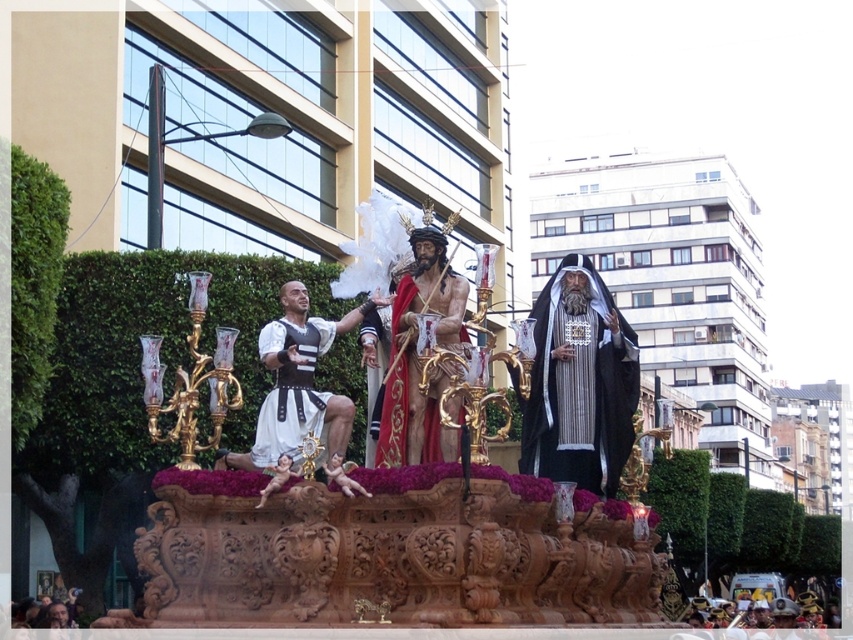
Question: Which object appears farthest from the camera in this image?

Choices:
 (A) white leather tunic at center
 (B) smooth flesh cherub at center
 (C) white matte fabric at center

Answer: (A)

Question: Which is farther from the white matte fabric at center?

Choices:
 (A) smooth flesh cherub at center
 (B) smooth pink cherub at center
 (C) white leather tunic at center

Answer: (A)

Question: Does wooden carved figure at center appear on the right side of smooth pink cherub at center?

Choices:
 (A) yes
 (B) no

Answer: (A)

Question: From the image, what is the correct spatial relationship of white matte fabric at center in relation to white leather tunic at center?

Choices:
 (A) left
 (B) right

Answer: (A)

Question: Observing the image, what is the correct spatial positioning of wooden carved figure at center in reference to smooth flesh cherub at center?

Choices:
 (A) left
 (B) right

Answer: (B)

Question: Which of the following is the closest to the observer?

Choices:
 (A) smooth pink cherub at center
 (B) smooth flesh cherub at center
 (C) white leather tunic at center

Answer: (A)